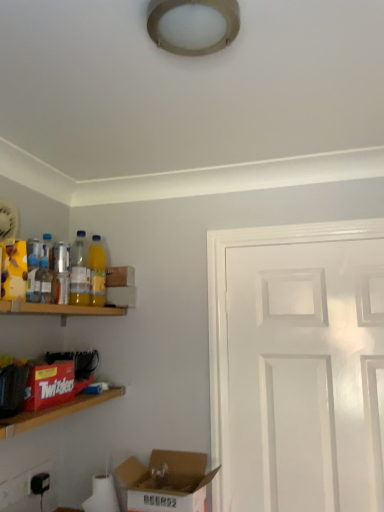
Question: Can you confirm if cardboard box at lower left, the first box positioned from the right, is taller than translucent plastic bottle at left, which is the 2th bottle from front to back?

Choices:
 (A) yes
 (B) no

Answer: (A)

Question: Is translucent plastic bottle at left, which is the 2th bottle from front to back, at the back of cardboard box at lower left, the first box positioned from the right?

Choices:
 (A) yes
 (B) no

Answer: (B)

Question: Would you say cardboard box at lower left, the 1th box from the bottom, is outside translucent plastic bottle at left, which ranks as the 3th bottle in back-to-front order?

Choices:
 (A) no
 (B) yes

Answer: (B)

Question: Can you confirm if cardboard box at lower left, the 1th box from the bottom, is positioned to the left of translucent plastic bottle at left, which ranks as the 3th bottle in back-to-front order?

Choices:
 (A) no
 (B) yes

Answer: (A)

Question: From the image's perspective, would you say cardboard box at lower left, the first box positioned from the right, is shown under translucent plastic bottle at left, which ranks as the 3th bottle in back-to-front order?

Choices:
 (A) yes
 (B) no

Answer: (A)

Question: From the image's perspective, relative to black plastic electric outlet at lower left, the 2th electric outlet when ordered from front to back, is yellow translucent bottle at left, which appears as the first bottle when viewed from the back, above or below?

Choices:
 (A) above
 (B) below

Answer: (A)

Question: From a real-world perspective, relative to black plastic electric outlet at lower left, the 1th electric outlet when ordered from right to left, is yellow translucent bottle at left, which appears as the first bottle when viewed from the back, vertically above or below?

Choices:
 (A) below
 (B) above

Answer: (B)

Question: Based on their positions, is yellow translucent bottle at left, the 4th bottle when ordered from front to back, located to the left or right of black plastic electric outlet at lower left, the 2th electric outlet when ordered from front to back?

Choices:
 (A) left
 (B) right

Answer: (B)

Question: Based on their sizes in the image, would you say yellow translucent bottle at left, which appears as the first bottle when viewed from the back, is bigger or smaller than black plastic electric outlet at lower left, which is counted as the second electric outlet, starting from the left?

Choices:
 (A) small
 (B) big

Answer: (B)

Question: From a real-world perspective, relative to cardboard box at lower left, arranged as the second box when viewed from the left, is wooden shelf at left, placed as the first shelf when sorted from top to bottom, vertically above or below?

Choices:
 (A) above
 (B) below

Answer: (A)

Question: Is point (96, 314) positioned closer to the camera than point (162, 471)?

Choices:
 (A) closer
 (B) farther

Answer: (B)

Question: Is wooden shelf at left, the second shelf in the bottom-to-top sequence, taller or shorter than cardboard box at lower left, the first box positioned from the right?

Choices:
 (A) tall
 (B) short

Answer: (B)

Question: Considering the positions of wooden shelf at left, placed as the first shelf when sorted from top to bottom, and cardboard box at lower left, arranged as the second box when viewed from the left, in the image, is wooden shelf at left, placed as the first shelf when sorted from top to bottom, wider or thinner than cardboard box at lower left, arranged as the second box when viewed from the left,?

Choices:
 (A) wide
 (B) thin

Answer: (B)

Question: From the image's perspective, relative to wooden twizzlers box at left, the 2th shelf viewed from the top, is wooden shelf at left, placed as the first shelf when sorted from top to bottom, above or below?

Choices:
 (A) above
 (B) below

Answer: (A)

Question: Relative to wooden twizzlers box at left, the 2th shelf viewed from the top, is wooden shelf at left, the second shelf in the bottom-to-top sequence, in front or behind?

Choices:
 (A) front
 (B) behind

Answer: (B)